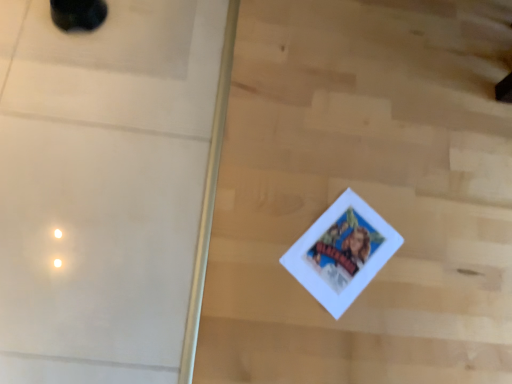
I want to click on free space to the left of black rubber shoe at upper left, so click(26, 13).